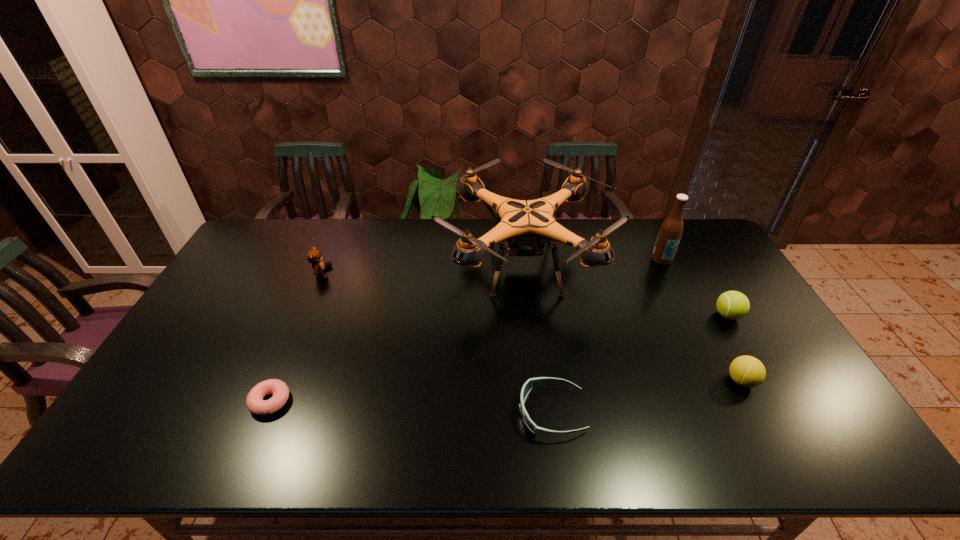
The width and height of the screenshot is (960, 540). Find the location of `blank region between the drone and the goggles`. blank region between the drone and the goggles is located at coordinates (538, 339).

The image size is (960, 540). In order to click on empty space between the teddy bear and the nearer tennis ball in this screenshot , I will do `click(532, 327)`.

Where is `empty location between the shortest object and the farther tennis ball`? This screenshot has width=960, height=540. empty location between the shortest object and the farther tennis ball is located at coordinates [499, 359].

The height and width of the screenshot is (540, 960). I want to click on unoccupied area between the farther tennis ball and the doughnut, so click(x=499, y=359).

Choose which object is the fourth nearest neighbor to the drone. Please provide its 2D coordinates. Your answer should be formatted as a tuple, i.e. [(x, y)], where the tuple contains the x and y coordinates of a point satisfying the conditions above.

[(733, 305)]

Identify which object is the third nearest to the teddy bear. Please provide its 2D coordinates. Your answer should be formatted as a tuple, i.e. [(x, y)], where the tuple contains the x and y coordinates of a point satisfying the conditions above.

[(527, 387)]

Find the location of `free location that satisfies the following two spatial constraints: 1. on the camera mount of the farther tennis ball; 2. on the left side of the drone`. free location that satisfies the following two spatial constraints: 1. on the camera mount of the farther tennis ball; 2. on the left side of the drone is located at coordinates (529, 315).

Image resolution: width=960 pixels, height=540 pixels. I want to click on vacant space that satisfies the following two spatial constraints: 1. on the front-facing side of the teddy bear; 2. on the right side of the nearer tennis ball, so click(276, 381).

You are a GUI agent. You are given a task and a screenshot of the screen. Output one action in this format:
    pyautogui.click(x=<x>, y=<y>)
    Task: Click on the free space that satisfies the following two spatial constraints: 1. on the front-facing side of the doughnut; 2. on the right side of the teddy bear
    
    Given the screenshot: What is the action you would take?
    pyautogui.click(x=268, y=401)

Locate an element on the screen. The image size is (960, 540). vacant space that satisfies the following two spatial constraints: 1. on the camera mount of the nearer tennis ball; 2. on the left side of the drone is located at coordinates (537, 381).